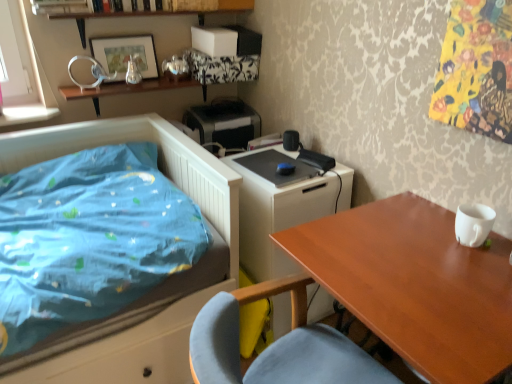
Locate an element on the screen. The width and height of the screenshot is (512, 384). free space above white glossy changing table at center (from a real-world perspective) is located at coordinates (290, 178).